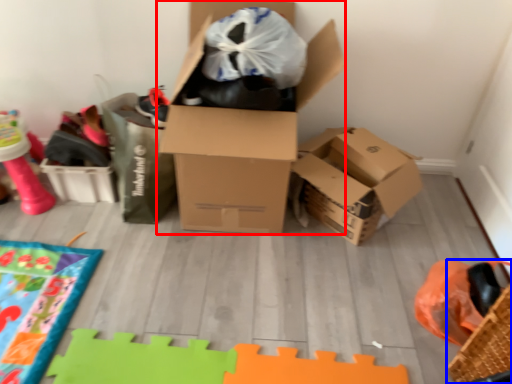
Question: Among these objects, which one is farthest to the camera, box (highlighted by a red box) or basket (highlighted by a blue box)?

Choices:
 (A) box
 (B) basket

Answer: (A)